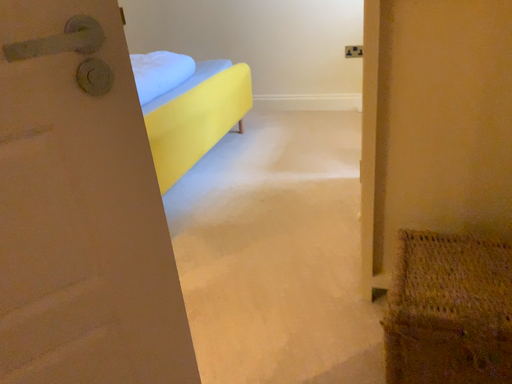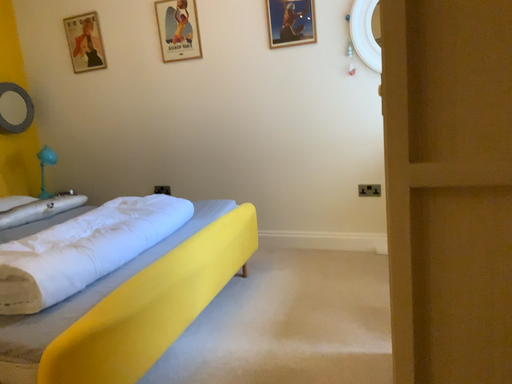
Question: Which way did the camera rotate in the video?

Choices:
 (A) rotated upward
 (B) rotated downward

Answer: (A)